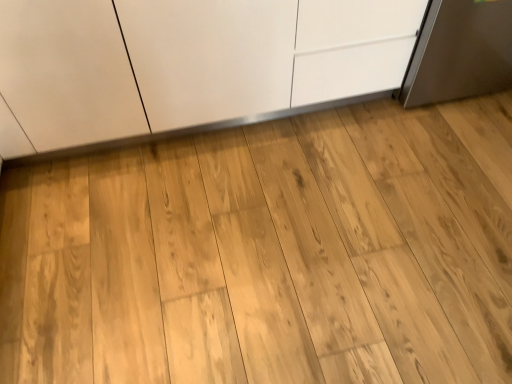
The width and height of the screenshot is (512, 384). I want to click on free space above natural wood dresser at center (from a real-world perspective), so click(295, 226).